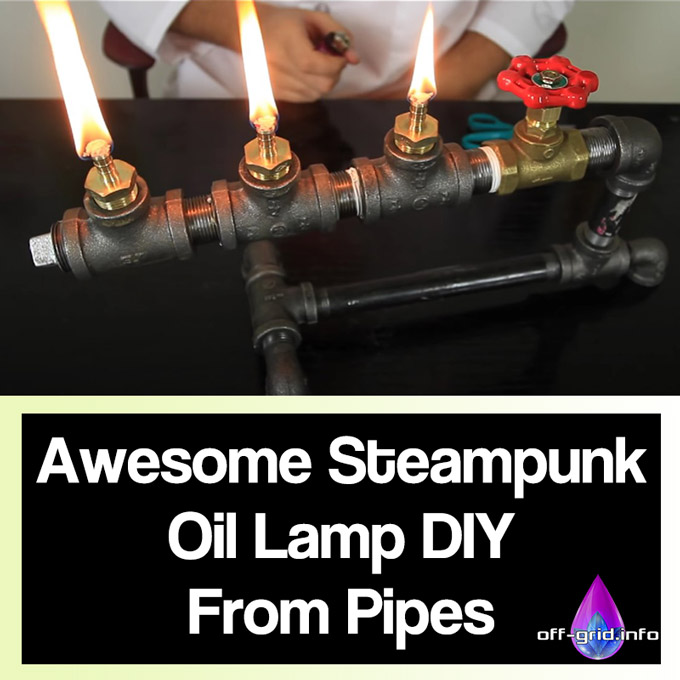
Where is `armrest`? This screenshot has height=680, width=680. armrest is located at coordinates (130, 51), (555, 43).